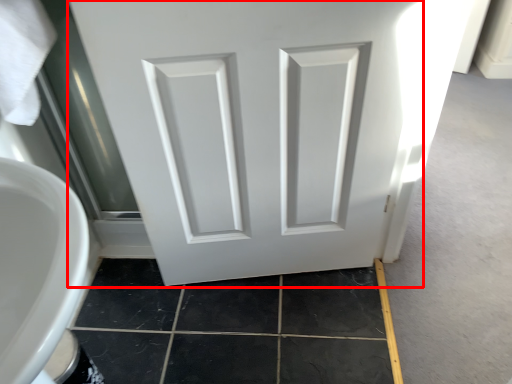
Question: From the image's perspective, where is door (annotated by the red box) located relative to tile?

Choices:
 (A) below
 (B) above

Answer: (B)